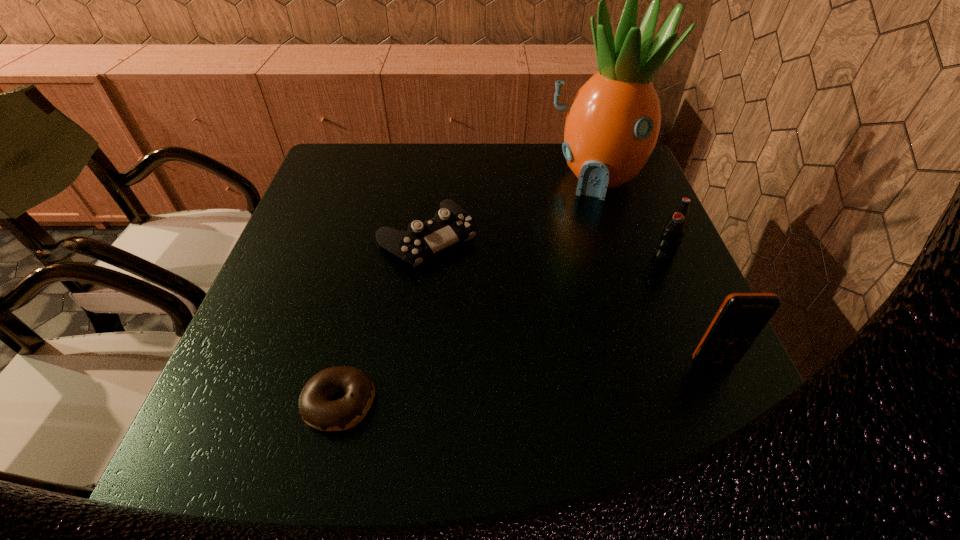
Identify the location of object located at the left edge. (316, 409).

The height and width of the screenshot is (540, 960). Identify the location of cellular telephone that is at the right edge. point(742,316).

Image resolution: width=960 pixels, height=540 pixels. I want to click on pop at the right edge, so click(x=675, y=228).

Find the location of a particular element. The height and width of the screenshot is (540, 960). pineapple that is at the right edge is located at coordinates (612, 125).

The width and height of the screenshot is (960, 540). I want to click on object at the near left corner, so click(x=316, y=409).

Where is `object positioned at the far right corner`? The height and width of the screenshot is (540, 960). object positioned at the far right corner is located at coordinates (612, 125).

The image size is (960, 540). I want to click on blank space at the far edge of the desktop, so click(x=527, y=157).

This screenshot has height=540, width=960. Identify the location of free spot at the near edge of the desktop. (470, 411).

In the image, there is a desktop. Identify the location of free space at the left edge. Image resolution: width=960 pixels, height=540 pixels. (315, 234).

What are the coordinates of `free space at the right edge of the desktop` in the screenshot? It's located at (617, 219).